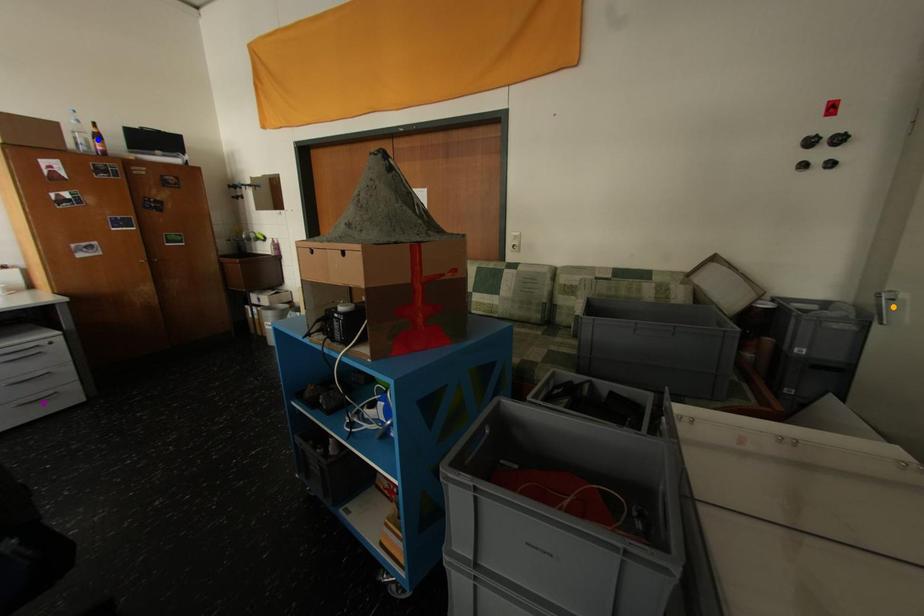
Consider the image. Order these from farthest to nearest:
A) purple point
B) blue point
C) orange point

blue point
purple point
orange point